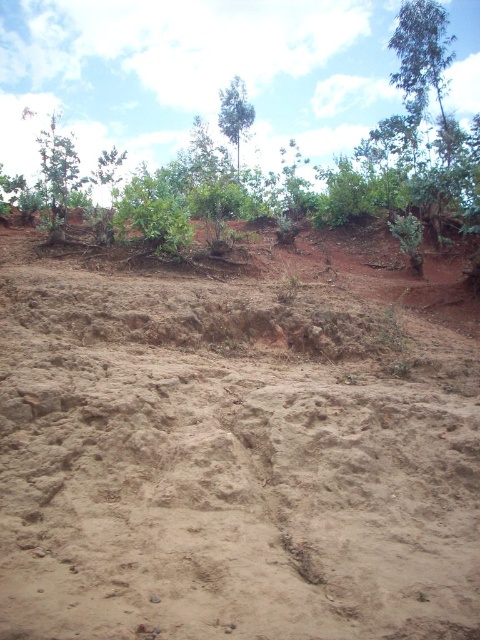
You are standing on the brown sandy dirt field at center and want to walk to the green leafy tree at left. Based on the scene description, which direction should you face to head towards the tree?

You should face towards the left direction because the green leafy tree at left is located to the left side of the brown sandy dirt field at center.

You are standing in the natural outdoor scene described. You see a brown sandy dirt field at center and a green leafy tree at upper center. Which object is located lower in the scene?

The brown sandy dirt field at center is positioned under the green leafy tree at upper center, so the brown sandy dirt field at center is lower in the scene.